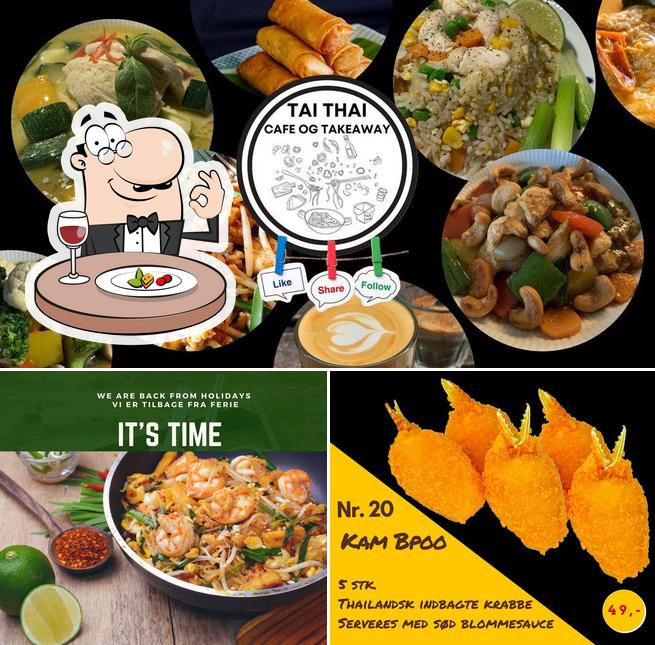
The width and height of the screenshot is (655, 645). I want to click on plates of food, so click(x=185, y=508), click(x=492, y=263), click(x=6, y=326), click(x=228, y=326), click(x=635, y=57), click(x=512, y=129), click(x=297, y=37), click(x=139, y=86).